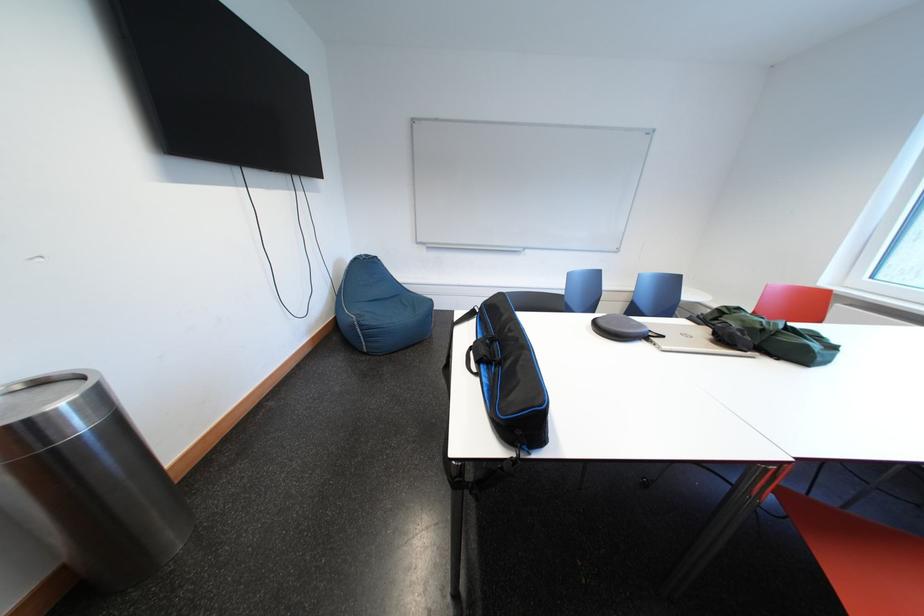
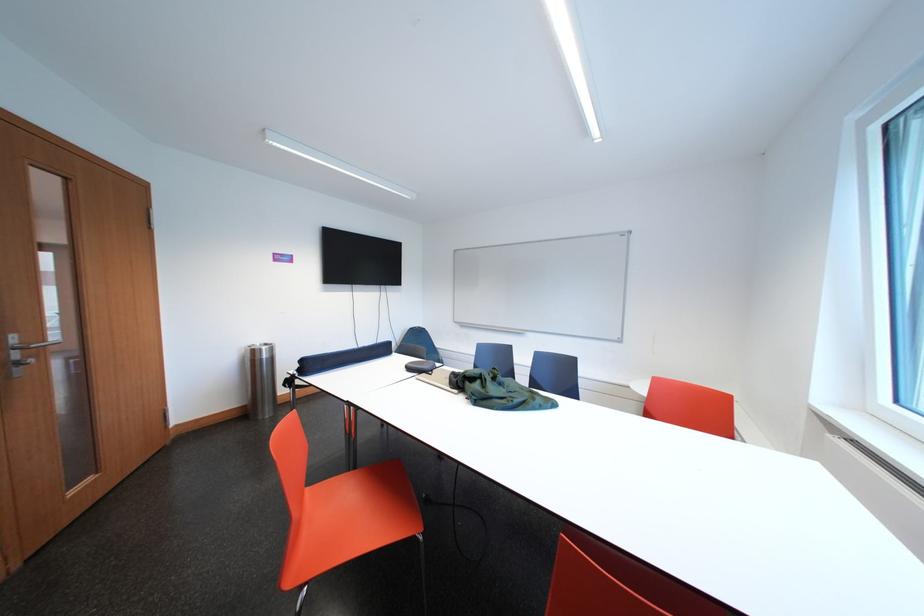
Where in the second image is the point corresponding to (x=30, y=439) from the first image?

(263, 357)